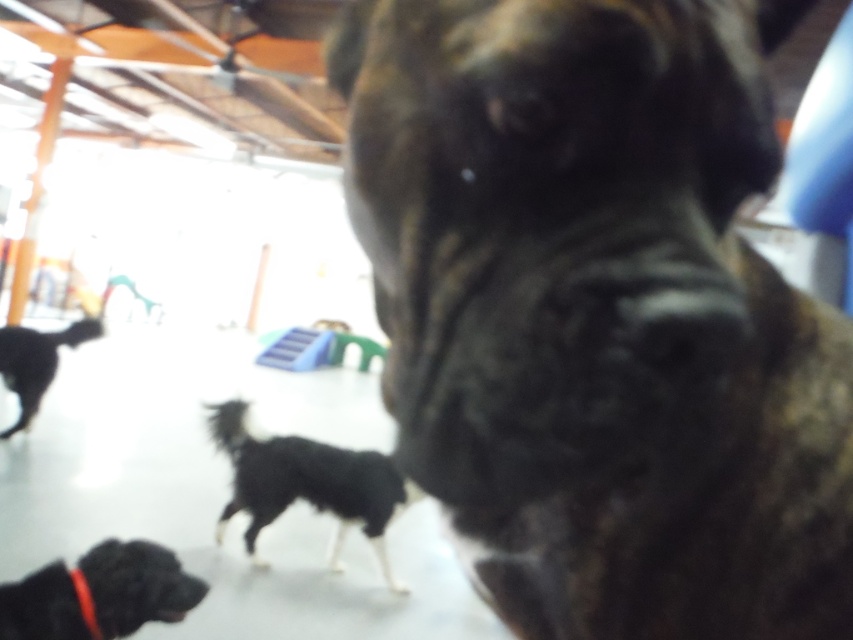
You are a photographer trying to capture a clear image of the black fur dog at center and the red fabric neckband at lower left. Based on the scene description, which object is bigger in the photo?

The black fur dog at center is larger in size compared to the red fabric neckband at lower left, so it appears bigger in the photo.

You are a dog owner who wants to find your brown brindle dog at center in the play area. You notice another black fur dog at left nearby. Based on their sizes, which dog should you approach first?

The brown brindle dog at center is larger than the black fur dog at left, so you should approach the brown brindle dog at center first since it is bigger and easier to spot.